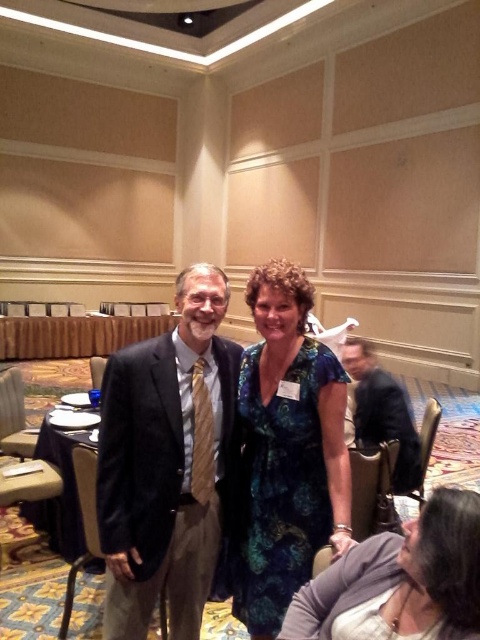
Where is the velvet black suit at center located in the image?

The velvet black suit at center is located at point 0.723 on the x axis and 0.350 on the y axis.